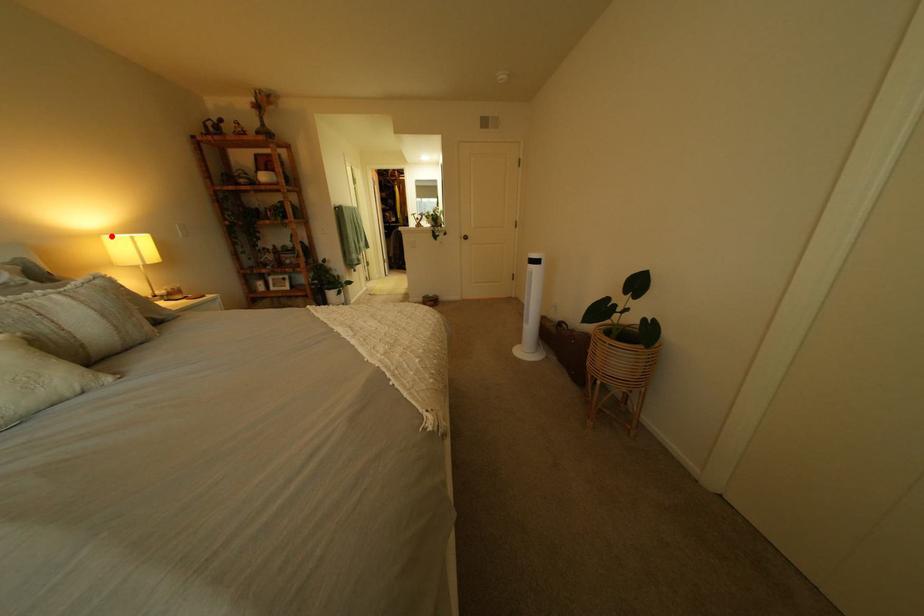
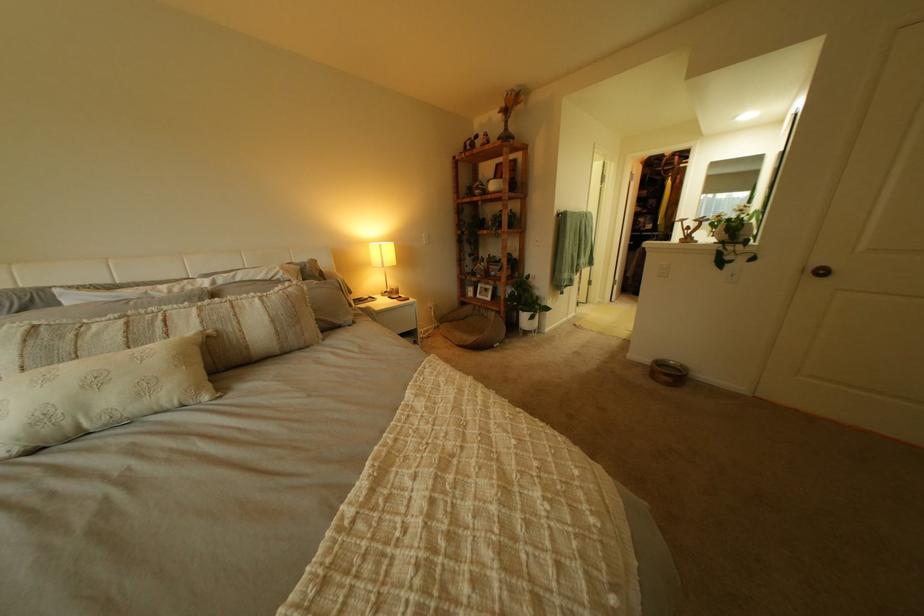
The point at the highlighted location is marked in the first image. Where is the corresponding point in the second image?

(381, 244)